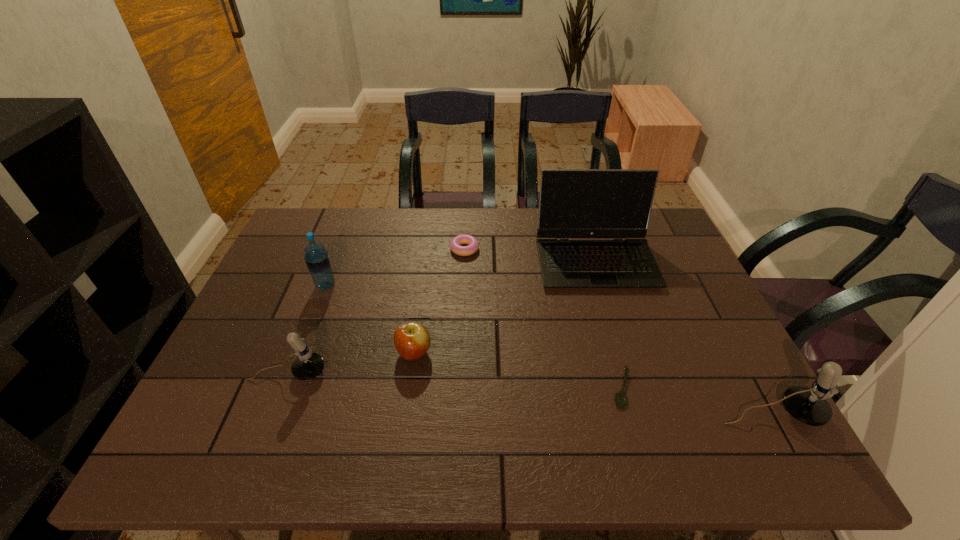
The image size is (960, 540). What are the coordinates of `free space between the tallest object and the fourth object from right to left` in the screenshot? It's located at (530, 255).

You are a GUI agent. You are given a task and a screenshot of the screen. Output one action in this format:
    pyautogui.click(x=<x>, y=<y>)
    Task: Click on the free point between the right microphone and the water bottle
    Image resolution: width=960 pixels, height=540 pixels.
    Given the screenshot: What is the action you would take?
    pyautogui.click(x=548, y=349)

Image resolution: width=960 pixels, height=540 pixels. I want to click on the second closest object relative to the fourth object from right to left, so click(x=412, y=340).

Where is `object that ranks as the fifth closest to the shorter microphone`? This screenshot has width=960, height=540. object that ranks as the fifth closest to the shorter microphone is located at coordinates (621, 399).

Identify the location of blank space that satisfies the following two spatial constraints: 1. on the front side of the doughnut; 2. on the right side of the soupspoon. The image size is (960, 540). (459, 389).